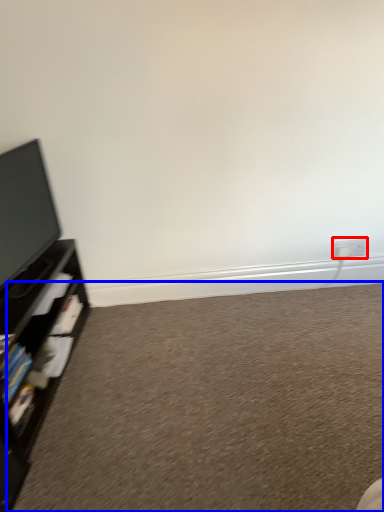
Question: Which point is further to the camera, electric outlet (highlighted by a red box) or plain (highlighted by a blue box)?

Choices:
 (A) electric outlet
 (B) plain

Answer: (A)